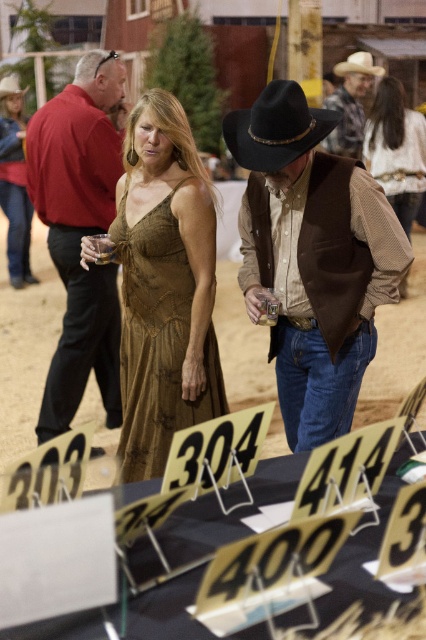
From the picture: You are at an outdoor event and see two hats, the brown suede cowboy hat at center and the brown leather cowboy hat at upper right. Which one is smaller?

The brown suede cowboy hat at center is smaller than the brown leather cowboy hat at upper right.

You are a photographer standing at the edge of the event area. You want to take a photo of the woman in the sleeveless earth toned dress and the brown suede cowboy hat at center. How far apart are they in meters?

The woman in the sleeveless earth toned dress and the brown suede cowboy hat at center are 1.83 meters apart.